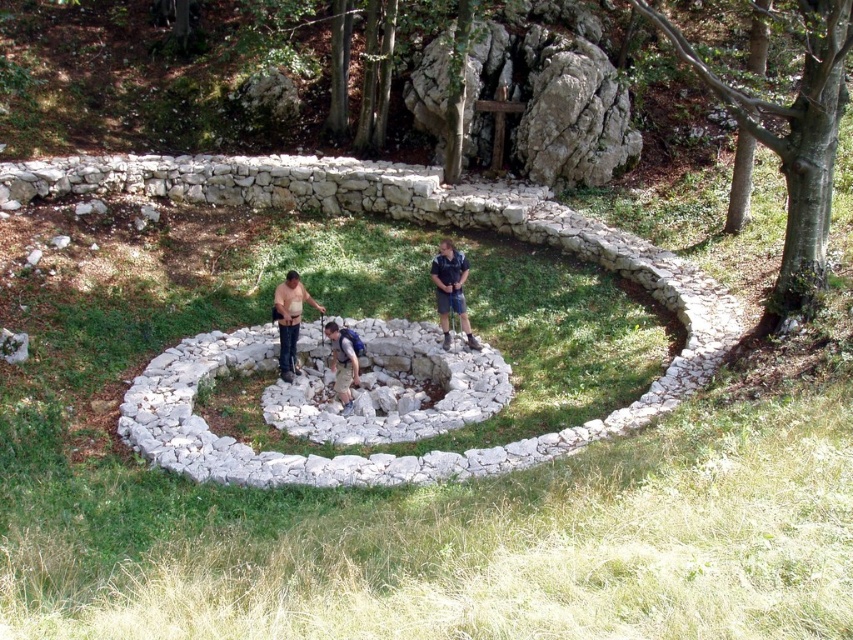
You are standing at the edge of the spiral stone path and see a person wearing a blue denim shirt at center and denim shorts at center. Which piece of clothing is closer to you?

The blue denim shirt at center is closer to you because it is positioned further to the viewer than the denim shorts at center.

You are a photographer planning to take a portrait of someone wearing the light brown leather shirt at center and denim shorts at center. You want to ensure the shirt doesn not overwhelm the outfit. Based on the scene description, what adjustment could you make to the composition to balance the visual weight?

Since the light brown leather shirt at center is wider than the denim shorts at center, you can position the person sideways so that only one shoulder and part of the shirt are visible, reducing the shirt s dominance in the frame.